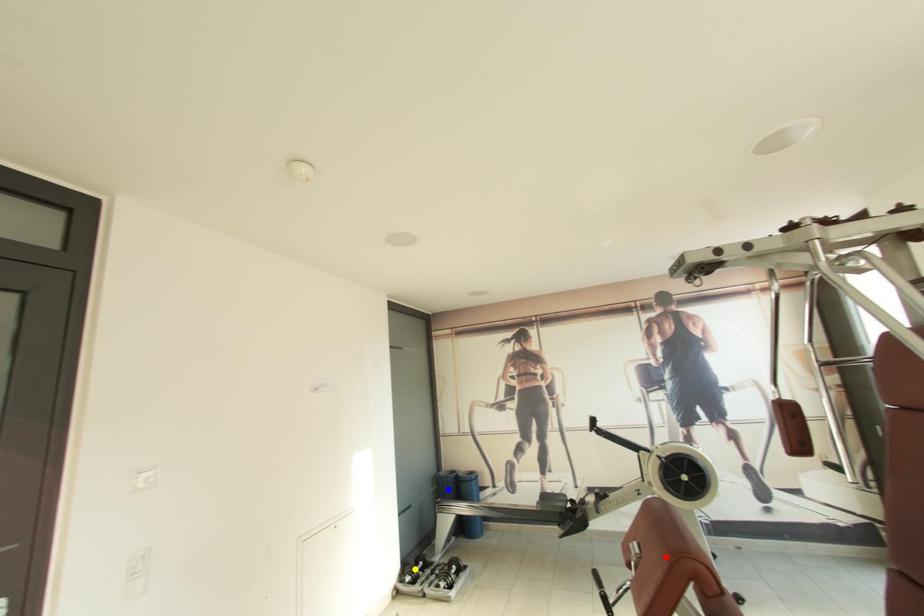
Based on the photo, order these from nearest to farthest:
1. blue point
2. yellow point
3. red point

blue point
yellow point
red point